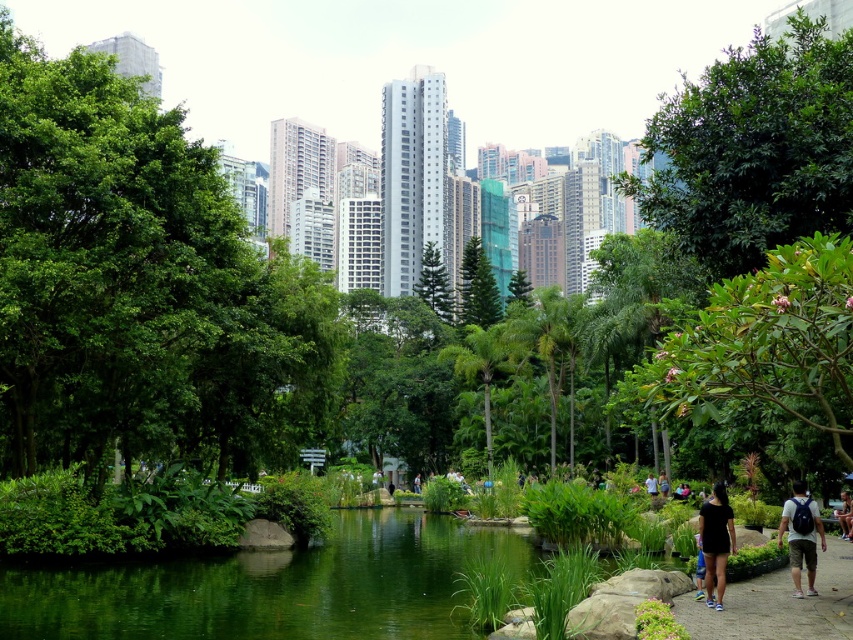
Question: Which point is farther to the camera?

Choices:
 (A) green liquid water at center
 (B) green leafy bush at center

Answer: (A)

Question: Can you confirm if smooth concrete path at lower right is smaller than black fabric at lower right?

Choices:
 (A) yes
 (B) no

Answer: (B)

Question: Can you confirm if green leafy tree at center is positioned below black fabric at lower right?

Choices:
 (A) yes
 (B) no

Answer: (B)

Question: Estimate the real-world distances between objects in this image. Which object is closer to the dark gray backpack at lower right?

Choices:
 (A) green leafy tree at upper right
 (B) light brown leather jacket at lower right
 (C) green liquid water at center

Answer: (A)

Question: Does green leafy tree at center have a larger size compared to green liquid water at center?

Choices:
 (A) no
 (B) yes

Answer: (B)

Question: Which of the following is the farthest from the observer?

Choices:
 (A) light brown leather jacket at lower right
 (B) green leafy bush at center
 (C) dark gray backpack at lower right

Answer: (A)